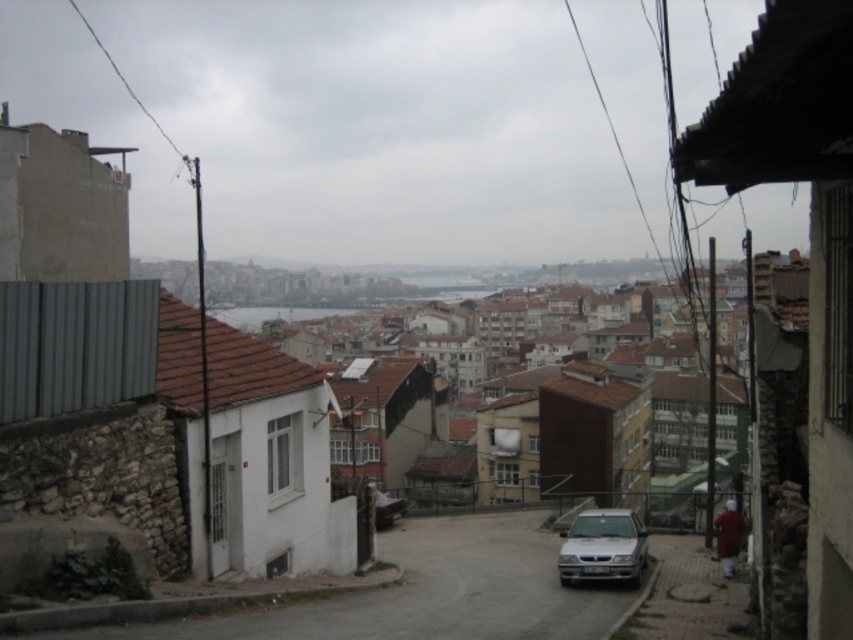
Question: Does silver metallic car at lower center have a larger size compared to metallic silver car at center?

Choices:
 (A) no
 (B) yes

Answer: (B)

Question: Among these points, which one is farthest from the camera?

Choices:
 (A) (375, 508)
 (B) (625, 577)

Answer: (A)

Question: Which point is farther from the camera taking this photo?

Choices:
 (A) (387, 506)
 (B) (602, 568)

Answer: (A)

Question: Where is silver metallic car at lower center located in relation to metallic silver car at center in the image?

Choices:
 (A) left
 (B) right

Answer: (B)

Question: Can you confirm if silver metallic car at lower center is positioned to the right of metallic silver car at center?

Choices:
 (A) no
 (B) yes

Answer: (B)

Question: Which point is farther to the camera?

Choices:
 (A) silver metallic car at lower center
 (B) metallic silver car at center

Answer: (B)